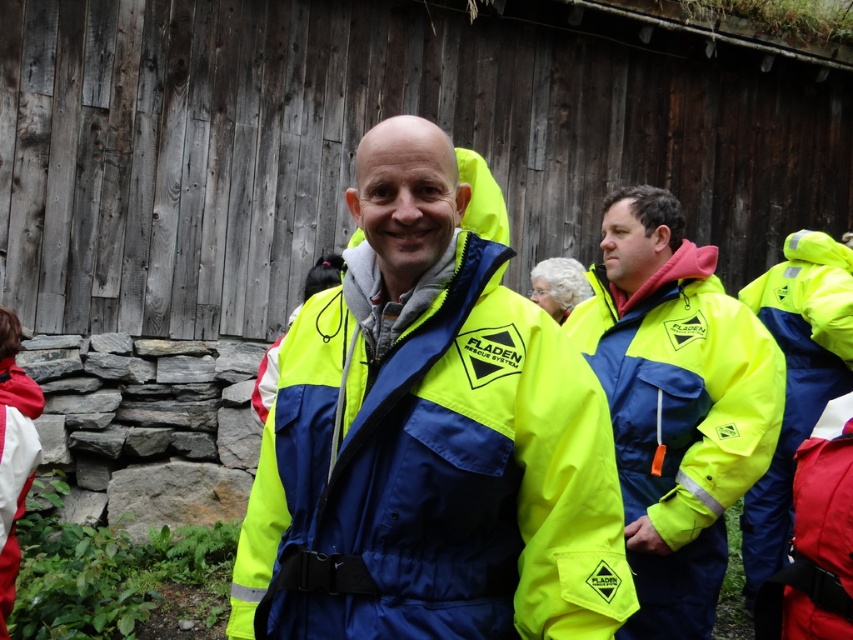
You are a FLADEN RESCUE SYSTEM team member who needs to retrieve an item from the ground between the matte yellow jacket at right and the neon yellow fabric safety vest at right. The item is 3 feet long. Can you safely reach it without moving either item?

The matte yellow jacket at right and neon yellow fabric safety vest at right are 6.58 feet apart, so the 3 feet long item is within the space between them. You can safely reach it without moving either item.

From the picture: You are a photographer trying to capture a photo of the matte yellow jacket at right and the matte red safety vest at lower right. Which object should you focus on first if you want to ensure both are in the frame without moving the camera?

The matte yellow jacket at right is much taller than the matte red safety vest at lower right, so focusing on the taller matte yellow jacket at right first will help ensure both are in the frame without needing to adjust the camera position.